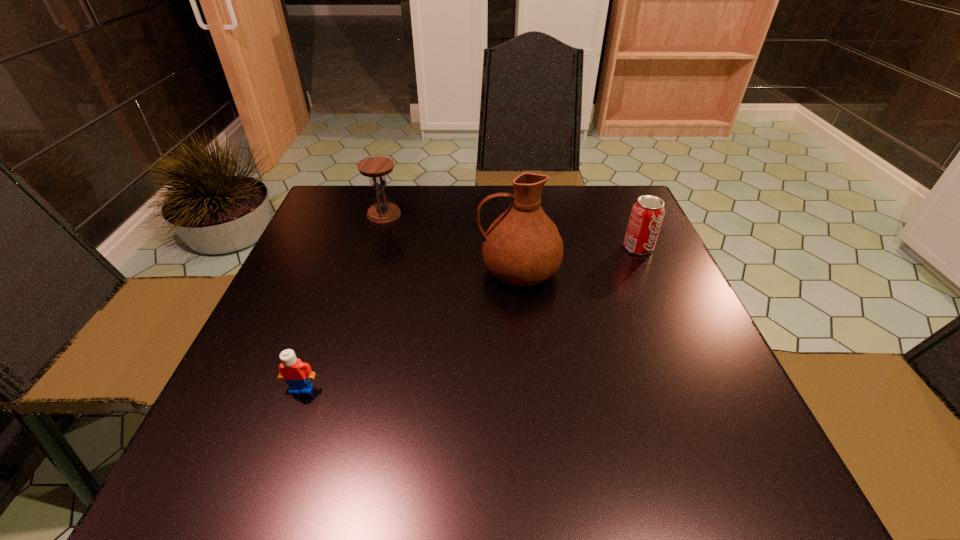
Where is `the third closest object to the soda can`? This screenshot has height=540, width=960. the third closest object to the soda can is located at coordinates (297, 374).

Identify the location of the third closest object to the hourglass. This screenshot has width=960, height=540. (647, 213).

Where is `vacant space that satisfies the following two spatial constraints: 1. on the side of the third object from left to right with the handle; 2. on the face of the shortest object`? This screenshot has width=960, height=540. vacant space that satisfies the following two spatial constraints: 1. on the side of the third object from left to right with the handle; 2. on the face of the shortest object is located at coordinates point(530,389).

The height and width of the screenshot is (540, 960). Identify the location of vacant area in the image that satisfies the following two spatial constraints: 1. on the side of the second object from right to left with the handle; 2. on the face of the nearest object. (530, 389).

The image size is (960, 540). What are the coordinates of `free space that satisfies the following two spatial constraints: 1. on the side of the second object from right to left with the handle; 2. on the face of the nearest object` in the screenshot? It's located at (530, 389).